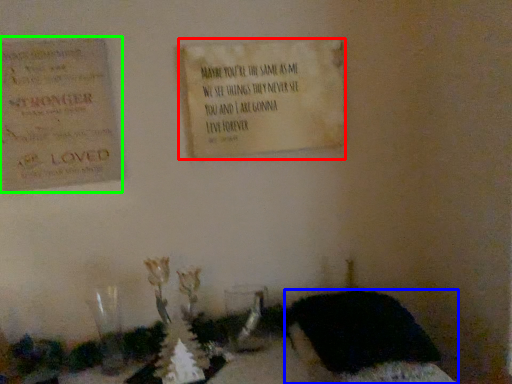
Question: Estimate the real-world distances between objects in this image. Which object is closer to notice (highlighted by a red box), furniture (highlighted by a blue box) or cardboard (highlighted by a green box)?

Choices:
 (A) furniture
 (B) cardboard

Answer: (B)